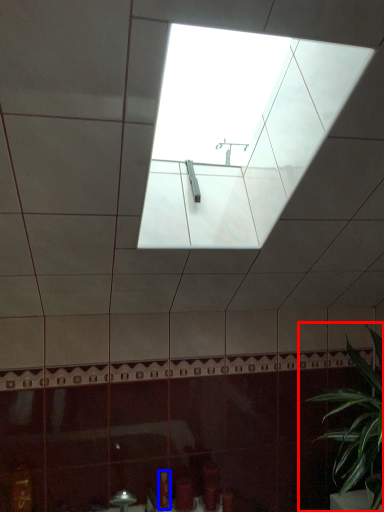
Question: Which point is further to the camera, houseplant (highlighted by a red box) or toiletry (highlighted by a blue box)?

Choices:
 (A) houseplant
 (B) toiletry

Answer: (B)